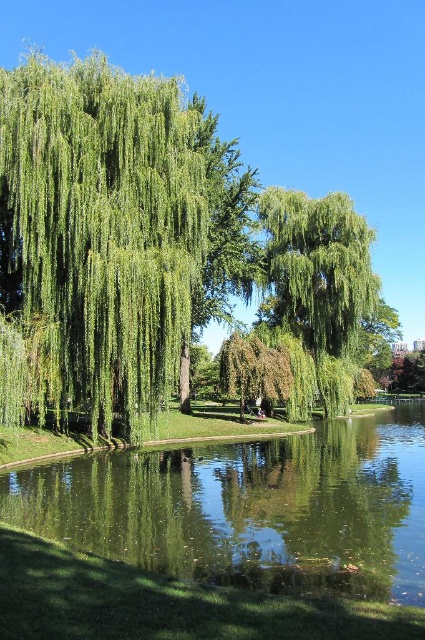
You are standing in the park and want to take a photo of both point (88, 128) and point (348, 285) in the scene. Which point will appear larger in your photo?

Point (88, 128) will appear larger in the photo because it is closer to the camera than point (348, 285).

You are planning to take a photo of the green leafy willow at left and the green reflective water at center. Which object will appear narrower in the photo?

The green leafy willow at left will appear narrower in the photo because it is thinner than the green reflective water at center.